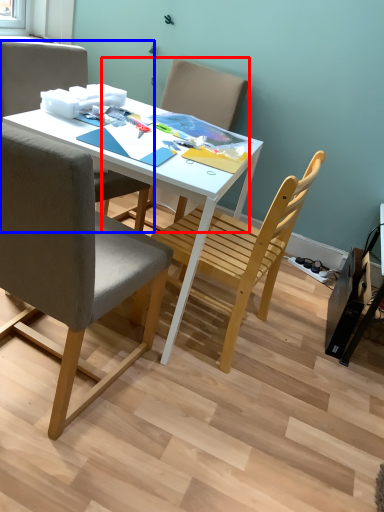
Question: Which object is further to the camera taking this photo, chair (highlighted by a red box) or chair (highlighted by a blue box)?

Choices:
 (A) chair
 (B) chair

Answer: (A)